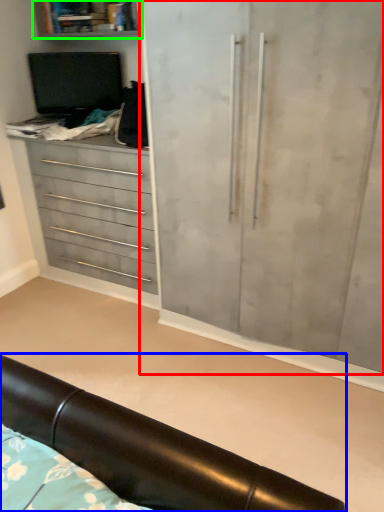
Question: Considering the real-world distances, which object is farthest from cupboard (highlighted by a red box)? furniture (highlighted by a blue box) or shelf (highlighted by a green box)?

Choices:
 (A) furniture
 (B) shelf

Answer: (B)